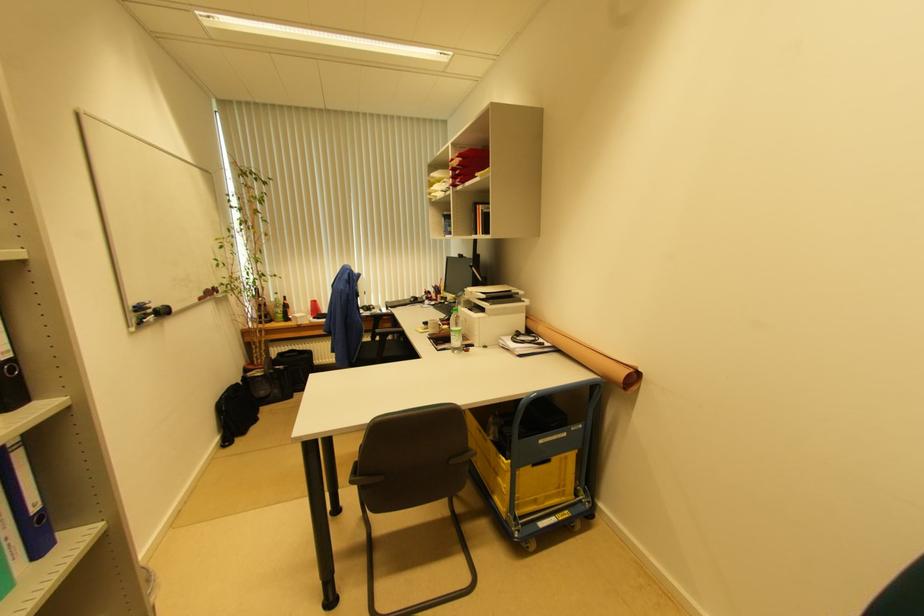
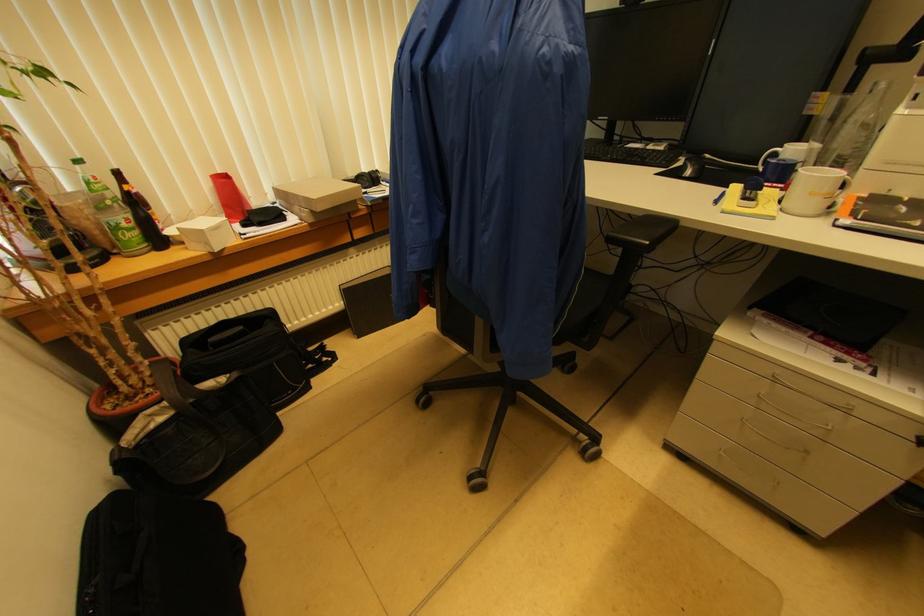
Where in the second image is the point corresponding to pixel 284 313 from the first image?

(131, 219)